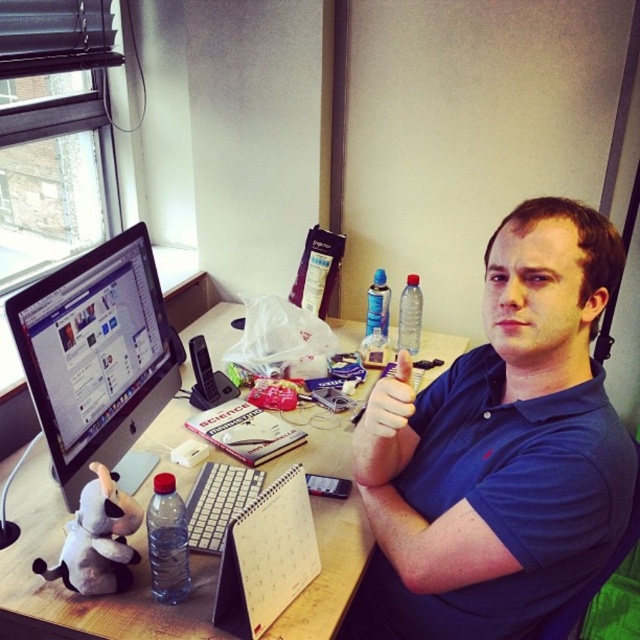
You are setting up a new monitor for a client. The client wants the matte black monitor at left to be placed above the woodendesk at center. Is the current setup already meeting their requirement?

The woodendesk at center is positioned under the matte black monitor at left, so the matte black monitor at left is already placed above the woodendesk at center. The current setup meets the client requirement.

You are organizing a desk and need to place a new monitor. The woodendesk at center has a certain width compared to the matte black monitor at left. Can you determine if the desk is wide enough to accommodate the monitor?

The woodendesk at center is wider than the matte black monitor at left, so yes, the desk is wide enough to accommodate the monitor.